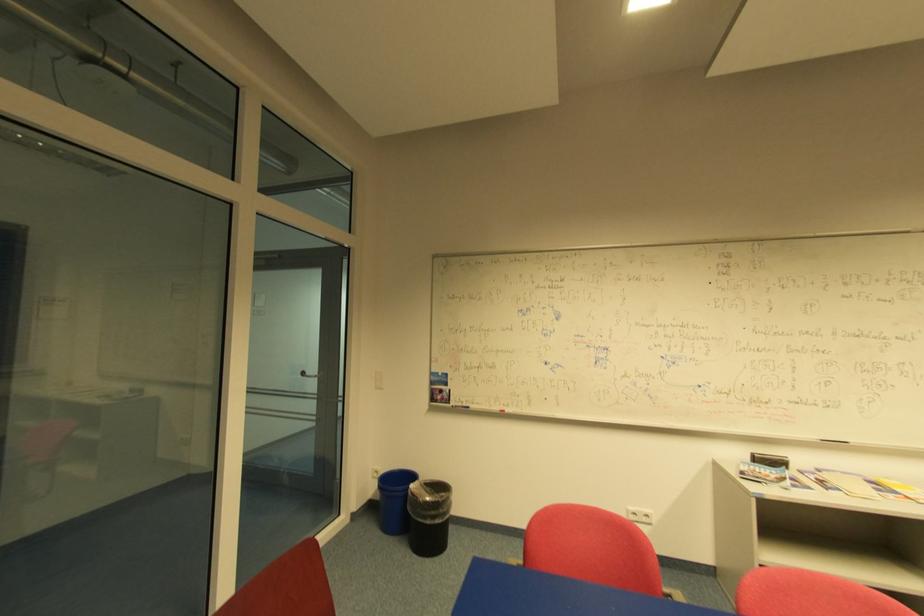
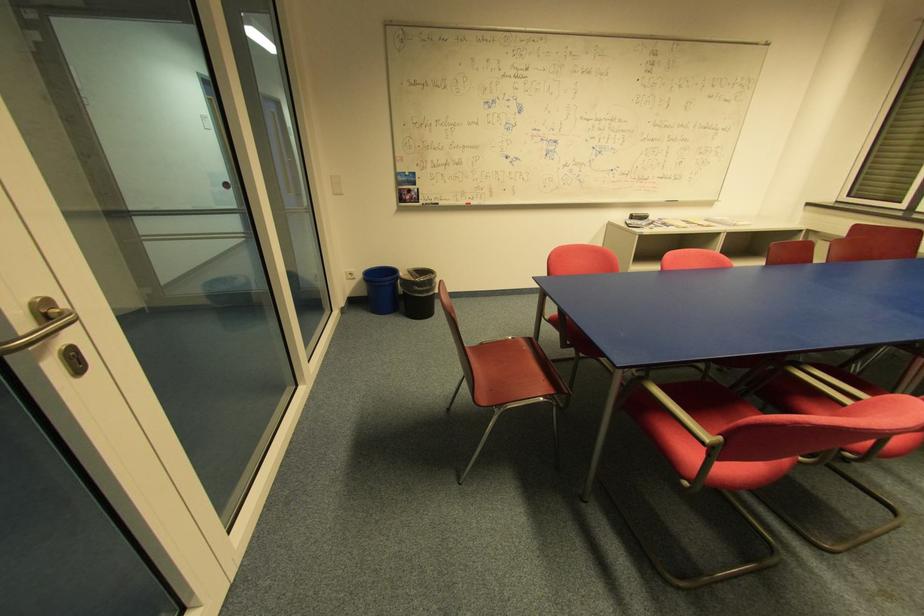
Find the pixel in the second image that matches [377,469] in the first image.

(349, 274)